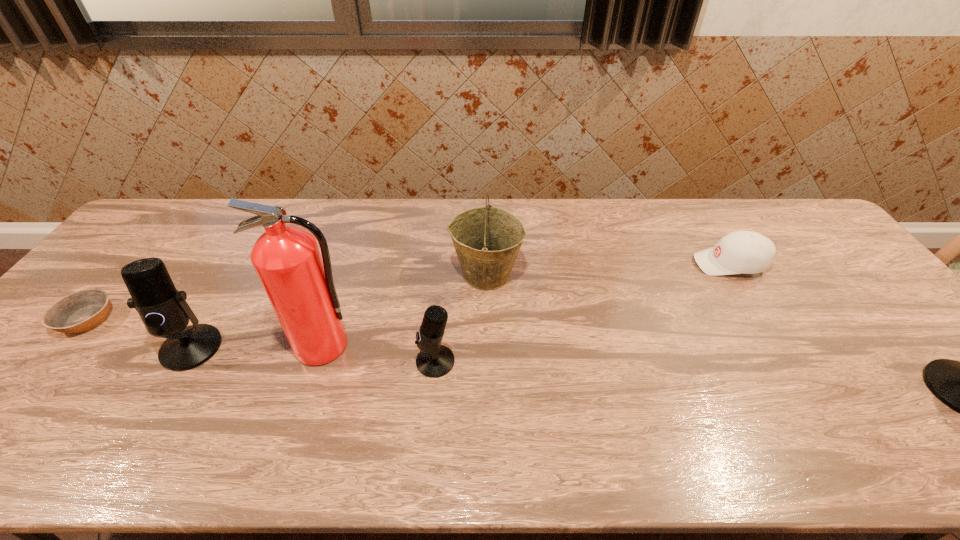
Where is `free space between the tallest object and the second object from left to right`? This screenshot has width=960, height=540. free space between the tallest object and the second object from left to right is located at coordinates (257, 347).

Where is `free space between the second object from right to left and the leftmost object`? free space between the second object from right to left and the leftmost object is located at coordinates (409, 292).

The width and height of the screenshot is (960, 540). What are the coordinates of `object that is the closest one to the sixth object from left to right` in the screenshot? It's located at (959, 385).

At what (x,y) coordinates should I click in order to perform the action: click on object identified as the fifth closest to the shortest object. Please return your answer as a coordinate pair (x, y). The width and height of the screenshot is (960, 540). Looking at the image, I should click on (740, 252).

You are a GUI agent. You are given a task and a screenshot of the screen. Output one action in this format:
    pyautogui.click(x=<x>, y=<y>)
    Task: Click on the microphone identified as the second closest to the rightmost microphone
    The height and width of the screenshot is (540, 960).
    Given the screenshot: What is the action you would take?
    pyautogui.click(x=163, y=309)

Locate an element on the screen. The width and height of the screenshot is (960, 540). the second closest microphone relative to the leftmost microphone is located at coordinates (959, 385).

In order to click on vacant space that satisfies the following two spatial constraints: 1. on the front-facing side of the baseball cap; 2. on the front side of the bowl in this screenshot , I will do `click(763, 320)`.

Locate an element on the screen. free spot that satisfies the following two spatial constraints: 1. on the front-facing side of the baseball cap; 2. on the stand of the second tallest microphone is located at coordinates (780, 348).

This screenshot has width=960, height=540. Identify the location of vacant position in the image that satisfies the following two spatial constraints: 1. on the back side of the bowl; 2. on the left side of the wine bucket. pyautogui.click(x=126, y=274).